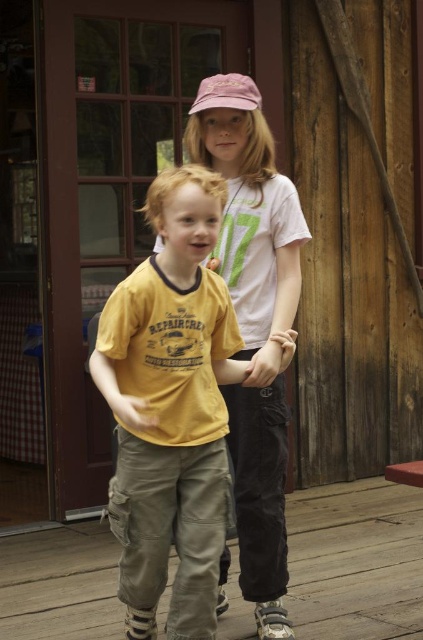
You are trying to determine if the wooden deck at center can support the weight of the pink fabric shirt at center. Based on their heights, can you infer anything about their ability to support weight?

The wooden deck at center is not as tall as the pink fabric shirt at center, but height does not directly indicate weight capacity. The wooden deck is likely designed to support weight, while the pink fabric shirt is clothing and not meant to bear weight.

You are standing on the wooden deck and want to reach the red framed door. There is a point at coordinates (228, 582). Is this point closer to you than the red framed door?

The point at coordinates (228, 582) is 12.68 feet from the viewer, while the red framed door is in the background. Since the door is farther away, the point is closer to you than the red framed door.